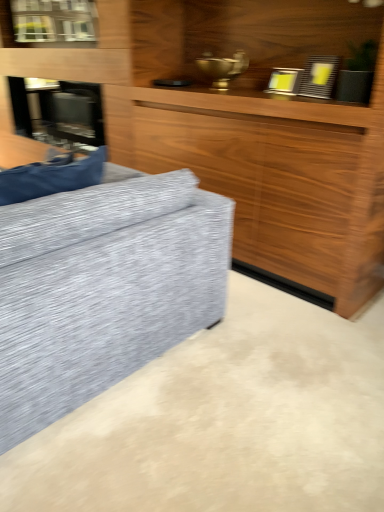
Question: Is stainless steel fireplace at left completely or partially outside of wooden cabinet at center?

Choices:
 (A) no
 (B) yes

Answer: (A)

Question: From the image's perspective, is stainless steel fireplace at left above wooden cabinet at center?

Choices:
 (A) yes
 (B) no

Answer: (B)

Question: Does stainless steel fireplace at left have a larger size compared to wooden cabinet at center?

Choices:
 (A) yes
 (B) no

Answer: (B)

Question: Considering the relative positions of stainless steel fireplace at left and wooden cabinet at center in the image provided, is stainless steel fireplace at left in front of wooden cabinet at center?

Choices:
 (A) yes
 (B) no

Answer: (B)

Question: Considering the relative sizes of stainless steel fireplace at left and wooden cabinet at center in the image provided, is stainless steel fireplace at left taller than wooden cabinet at center?

Choices:
 (A) yes
 (B) no

Answer: (B)

Question: From the image's perspective, is stainless steel fireplace at left below wooden cabinet at center?

Choices:
 (A) no
 (B) yes

Answer: (B)

Question: Is clear glass window at upper left not inside stainless steel fireplace at left?

Choices:
 (A) no
 (B) yes

Answer: (B)

Question: Is clear glass window at upper left behind stainless steel fireplace at left?

Choices:
 (A) no
 (B) yes

Answer: (A)

Question: Considering the relative sizes of clear glass window at upper left and stainless steel fireplace at left in the image provided, is clear glass window at upper left taller than stainless steel fireplace at left?

Choices:
 (A) yes
 (B) no

Answer: (B)

Question: Is clear glass window at upper left closer to the viewer compared to stainless steel fireplace at left?

Choices:
 (A) no
 (B) yes

Answer: (B)

Question: Can you confirm if clear glass window at upper left is positioned to the left of stainless steel fireplace at left?

Choices:
 (A) yes
 (B) no

Answer: (A)

Question: From the image's perspective, does clear glass window at upper left appear higher than stainless steel fireplace at left?

Choices:
 (A) no
 (B) yes

Answer: (B)

Question: From the image's perspective, is stainless steel fireplace at left beneath clear glass window at upper left?

Choices:
 (A) no
 (B) yes

Answer: (B)